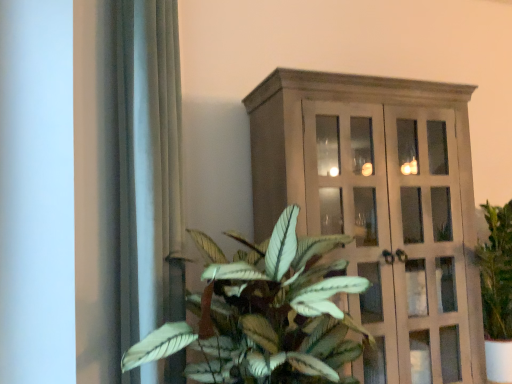
Question: Does matte wooden cabinet at right have a lesser width compared to wooden cabinet at upper center?

Choices:
 (A) no
 (B) yes

Answer: (A)

Question: Is matte wooden cabinet at right wider than wooden cabinet at upper center?

Choices:
 (A) yes
 (B) no

Answer: (A)

Question: Is the position of matte wooden cabinet at right less distant than that of wooden cabinet at upper center?

Choices:
 (A) yes
 (B) no

Answer: (B)

Question: From a real-world perspective, does matte wooden cabinet at right sit lower than wooden cabinet at upper center?

Choices:
 (A) no
 (B) yes

Answer: (B)

Question: Does matte wooden cabinet at right appear on the left side of wooden cabinet at upper center?

Choices:
 (A) no
 (B) yes

Answer: (A)

Question: Is matte wooden cabinet at right oriented towards wooden cabinet at upper center?

Choices:
 (A) yes
 (B) no

Answer: (B)

Question: Is wooden cabinet at upper center aimed at green leafy plant at center?

Choices:
 (A) no
 (B) yes

Answer: (A)

Question: Can you confirm if wooden cabinet at upper center is smaller than green leafy plant at center?

Choices:
 (A) no
 (B) yes

Answer: (A)

Question: Considering the relative sizes of wooden cabinet at upper center and green leafy plant at center in the image provided, is wooden cabinet at upper center wider than green leafy plant at center?

Choices:
 (A) yes
 (B) no

Answer: (B)

Question: From a real-world perspective, is wooden cabinet at upper center over green leafy plant at center?

Choices:
 (A) yes
 (B) no

Answer: (A)

Question: Is wooden cabinet at upper center not close to green leafy plant at center?

Choices:
 (A) yes
 (B) no

Answer: (B)

Question: From the image's perspective, would you say wooden cabinet at upper center is shown under green leafy plant at center?

Choices:
 (A) no
 (B) yes

Answer: (A)

Question: Does wooden cabinet at upper center have a greater width compared to satin gray curtain at left?

Choices:
 (A) no
 (B) yes

Answer: (B)